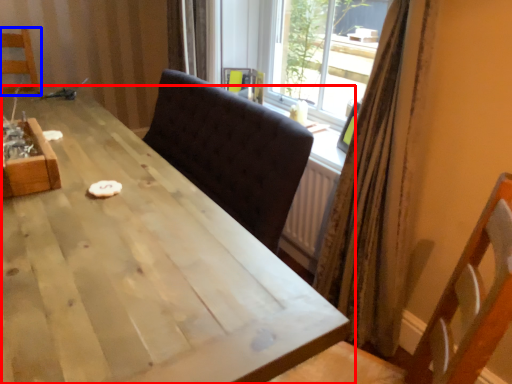
Question: Which of the following is the farthest to the observer, table (highlighted by a red box) or chair (highlighted by a blue box)?

Choices:
 (A) table
 (B) chair

Answer: (B)